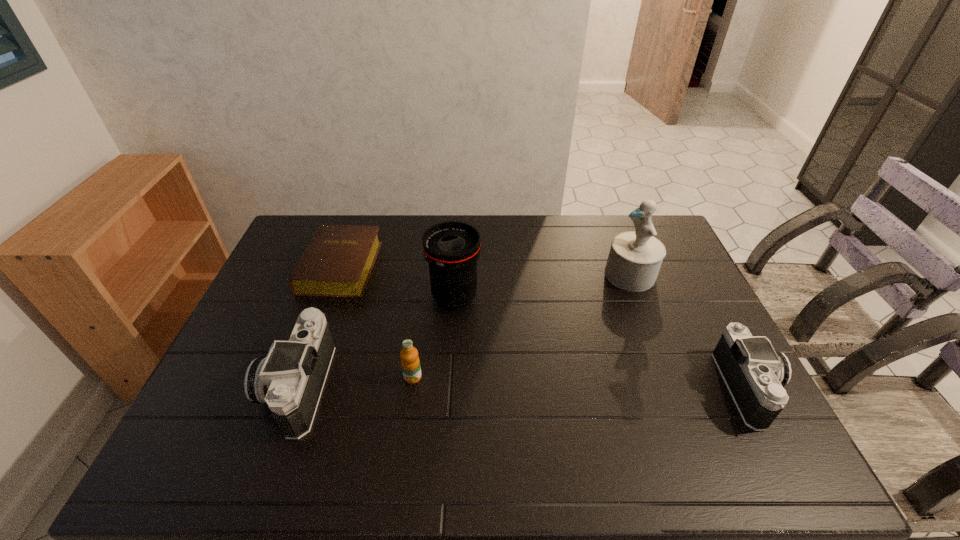
I want to click on vacant space that's between the fourth shortest object and the figurine, so click(x=465, y=330).

Where is `vacant space that is in between the taller camera and the orange juice`? Image resolution: width=960 pixels, height=540 pixels. vacant space that is in between the taller camera and the orange juice is located at coordinates (356, 381).

At what (x,y) coordinates should I click in order to perform the action: click on vacant space that is in between the telephoto lens and the orange juice. Please return your answer as a coordinate pair (x, y). Looking at the image, I should click on tap(434, 337).

Image resolution: width=960 pixels, height=540 pixels. Find the location of `free spot between the figurine and the Bible`. free spot between the figurine and the Bible is located at coordinates click(x=486, y=271).

Where is `vacant area that lies between the taller camera and the orange juice`? This screenshot has height=540, width=960. vacant area that lies between the taller camera and the orange juice is located at coordinates (356, 381).

Find the location of a particular element. The height and width of the screenshot is (540, 960). empty location between the rightmost object and the orange juice is located at coordinates (581, 383).

You are a GUI agent. You are given a task and a screenshot of the screen. Output one action in this format:
    pyautogui.click(x=<x>, y=<y>)
    Task: Click on the vacant area between the second tallest object and the fifth object from left to right
    The image size is (960, 540).
    Given the screenshot: What is the action you would take?
    pyautogui.click(x=542, y=286)

Identify the location of unoccupied position between the fifth shortest object and the Bible. This screenshot has height=540, width=960. (397, 282).

Locate an element on the screen. free space between the orange juice and the tallest object is located at coordinates (521, 326).

Where is `free space between the rightmost object and the orange juice`? The image size is (960, 540). free space between the rightmost object and the orange juice is located at coordinates (581, 383).